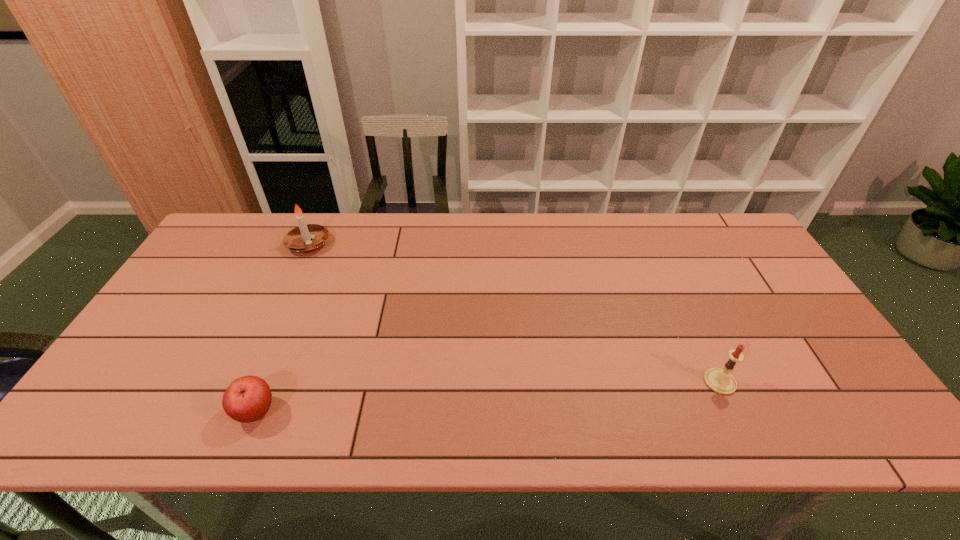
Identify the location of free space at the far edge. (442, 247).

This screenshot has width=960, height=540. Identify the location of free region at the near edge of the desktop. (467, 438).

I want to click on vacant area at the left edge, so tap(178, 374).

Identify the location of free space at the right edge of the desktop. The image size is (960, 540). (739, 308).

Locate an element on the screen. This screenshot has width=960, height=540. free region at the far right corner is located at coordinates (709, 225).

Locate an element on the screen. vacant space at the near right corner is located at coordinates (858, 407).

You are a GUI agent. You are given a task and a screenshot of the screen. Output one action in this format:
    pyautogui.click(x=<x>, y=<y>)
    Task: Click on the vacant space that is in between the nearer candle and the farther candle
    The height and width of the screenshot is (540, 960).
    Given the screenshot: What is the action you would take?
    pyautogui.click(x=515, y=313)

Where is `free point between the shortest object and the nearer candle`? free point between the shortest object and the nearer candle is located at coordinates (488, 396).

Locate an element on the screen. free spot between the right candle and the shortest object is located at coordinates (488, 396).

The width and height of the screenshot is (960, 540). What are the coordinates of `unoccupied area between the shortest object and the nearer candle` in the screenshot? It's located at (488, 396).